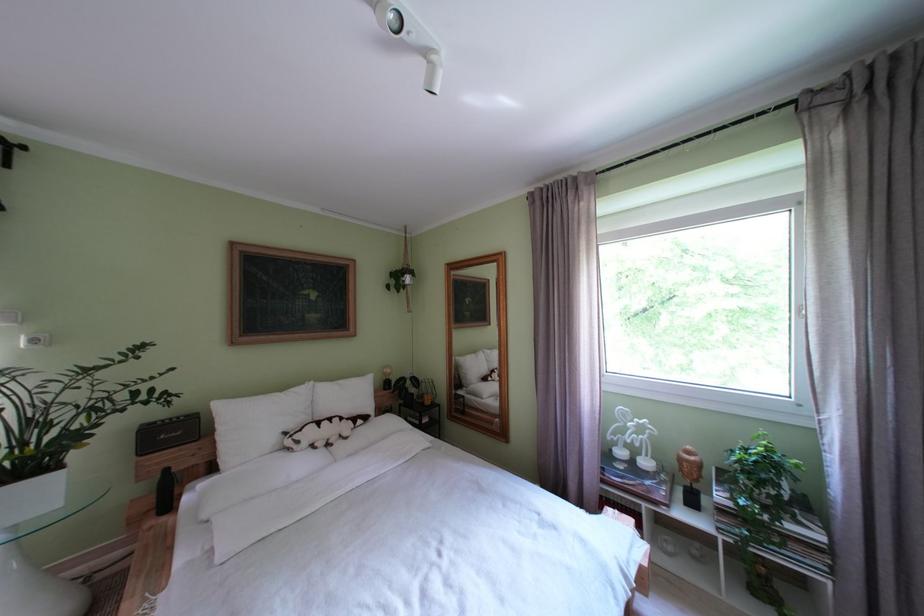
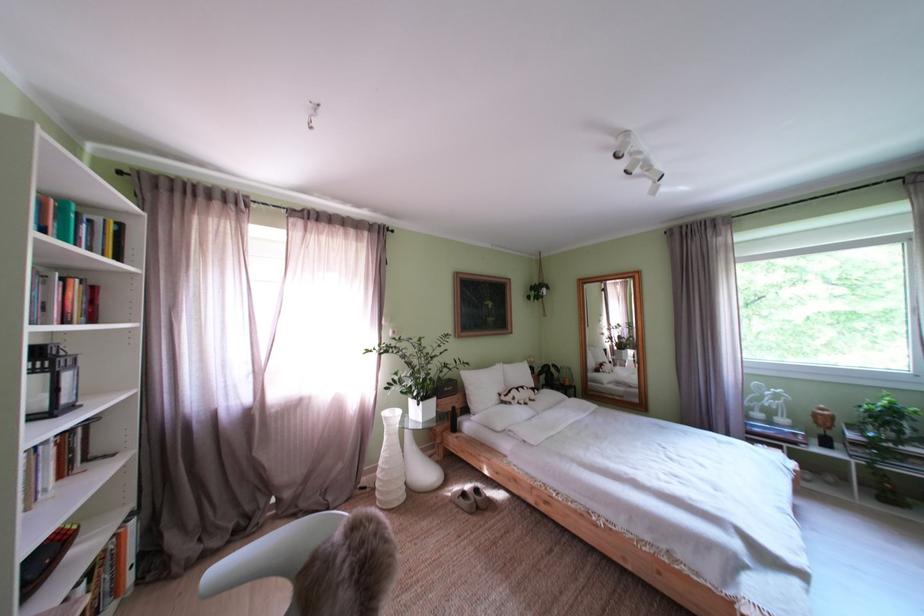
Where in the second image is the point corresponding to pixel 691 464 from the first image?

(825, 419)